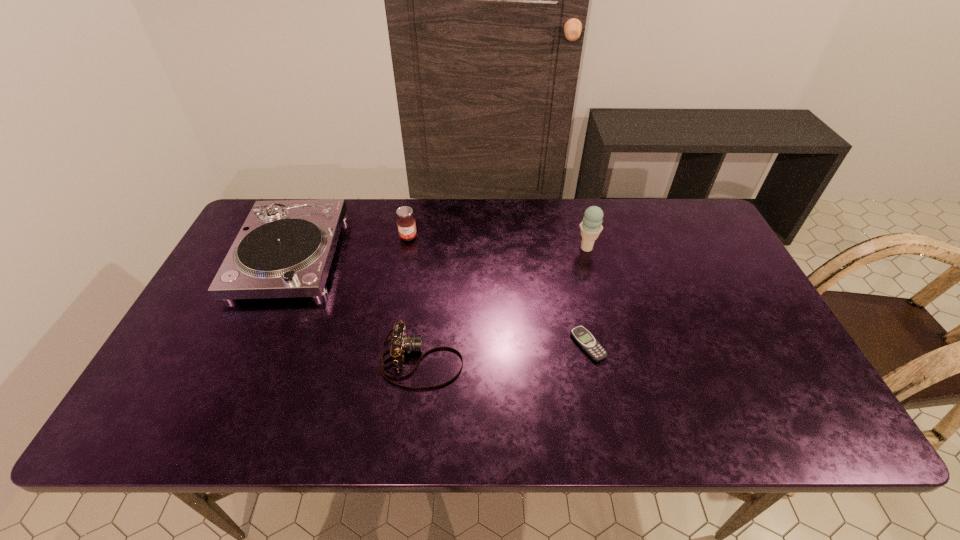
Where is `empty space that is in between the beeper and the tallest object`? The image size is (960, 540). empty space that is in between the beeper and the tallest object is located at coordinates (587, 296).

I want to click on vacant space in between the ice cream and the beeper, so click(587, 296).

Where is `empty space between the jam and the record player`? empty space between the jam and the record player is located at coordinates (349, 246).

This screenshot has width=960, height=540. What are the coordinates of `vacant point located between the jam and the record player` in the screenshot? It's located at (349, 246).

Image resolution: width=960 pixels, height=540 pixels. Find the location of `vacant space that's between the camera and the leftmost object`. vacant space that's between the camera and the leftmost object is located at coordinates (356, 307).

Where is `vacant space that's between the camera and the leftmost object`? The image size is (960, 540). vacant space that's between the camera and the leftmost object is located at coordinates (356, 307).

Identify the location of vacant space that's between the jam and the record player. This screenshot has height=540, width=960. (349, 246).

Where is `unoccupied position between the leftmost object and the second shortest object`? unoccupied position between the leftmost object and the second shortest object is located at coordinates (356, 307).

The width and height of the screenshot is (960, 540). I want to click on blank region between the tallest object and the camera, so click(504, 304).

The height and width of the screenshot is (540, 960). Identify the location of empty location between the record player and the shortest object. (439, 300).